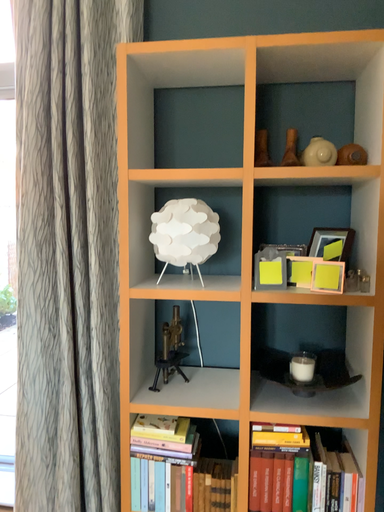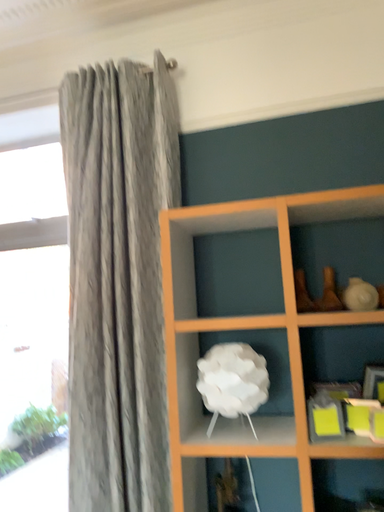
Question: Which way did the camera rotate in the video?

Choices:
 (A) rotated upward
 (B) rotated downward

Answer: (A)